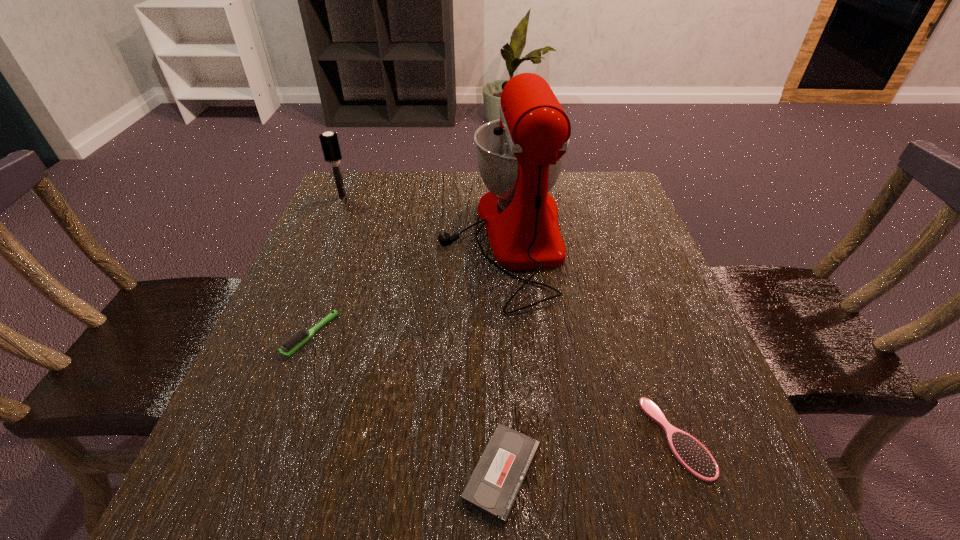
Find the location of a particular element. The width and height of the screenshot is (960, 540). free space between the second tallest object and the rightmost object is located at coordinates (510, 317).

Identify the location of empty location between the videotape and the tallest object. This screenshot has width=960, height=540. (502, 355).

Locate an element on the screen. The width and height of the screenshot is (960, 540). unoccupied area between the rightmost hairbrush and the mixer is located at coordinates (589, 338).

At what (x,y) coordinates should I click in order to perform the action: click on vacant area that lies between the videotape and the rightmost hairbrush. Please return your answer as a coordinate pair (x, y). The image size is (960, 540). Looking at the image, I should click on (589, 455).

Find the location of a particular element. unoccupied position between the tallest hairbrush and the second shortest hairbrush is located at coordinates (326, 266).

Where is `vacant area between the shortest object and the shortest hairbrush`? This screenshot has width=960, height=540. vacant area between the shortest object and the shortest hairbrush is located at coordinates (589, 455).

In order to click on empty space between the tallest object and the tallest hairbrush in this screenshot , I will do `click(422, 217)`.

Locate an element on the screen. This screenshot has height=540, width=960. vacant space that is in between the third shortest object and the fourth shortest object is located at coordinates (326, 266).

Image resolution: width=960 pixels, height=540 pixels. Identify the location of object that is the closest to the second shortest object. (494, 485).

This screenshot has width=960, height=540. What are the coordinates of `object that stands as the closest to the videotape` in the screenshot? It's located at (693, 456).